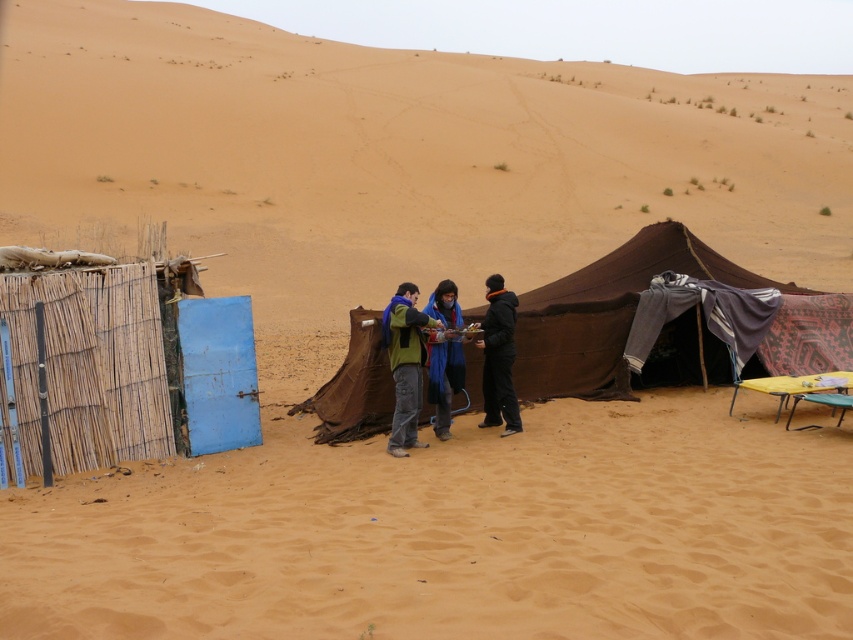
Which is above, fine-grained sand at center or blue fabric scarf at center?

blue fabric scarf at center is above.

Image resolution: width=853 pixels, height=640 pixels. What do you see at coordinates (457, 532) in the screenshot? I see `fine-grained sand at center` at bounding box center [457, 532].

Image resolution: width=853 pixels, height=640 pixels. What are the coordinates of `fine-grained sand at center` in the screenshot? It's located at (457, 532).

Can you confirm if fine-grained sand at center is positioned above black matte jacket at center?

No, fine-grained sand at center is not above black matte jacket at center.

Image resolution: width=853 pixels, height=640 pixels. What are the coordinates of `fine-grained sand at center` in the screenshot? It's located at (457, 532).

Can you confirm if woven bamboo fence at left is thinner than brown fabric tent at center?

Indeed, woven bamboo fence at left has a lesser width compared to brown fabric tent at center.

Who is taller, woven bamboo fence at left or brown fabric tent at center?

brown fabric tent at center

Which is behind, point (97, 280) or point (357, 349)?

The point (357, 349) is behind.

This screenshot has width=853, height=640. What are the coordinates of `woven bamboo fence at left` in the screenshot? It's located at (120, 362).